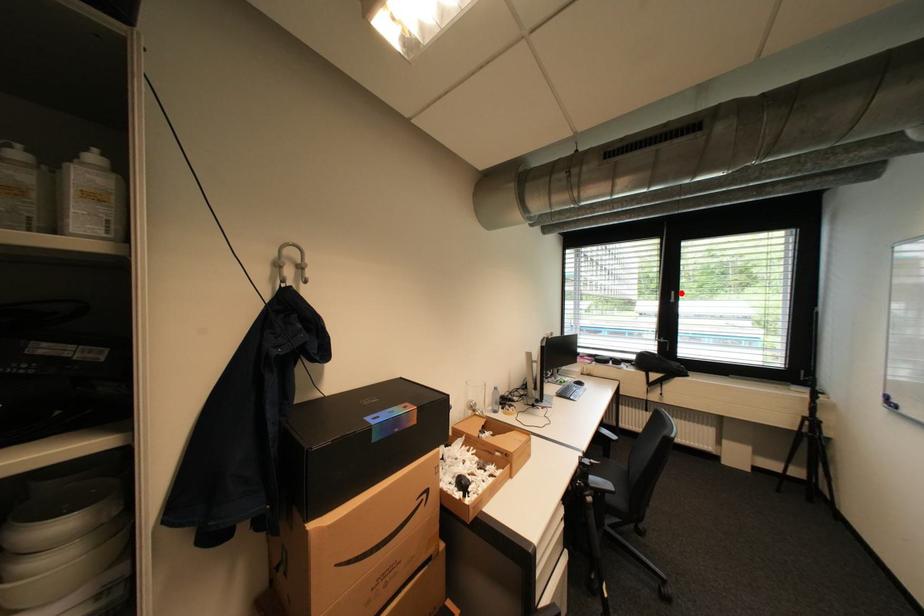
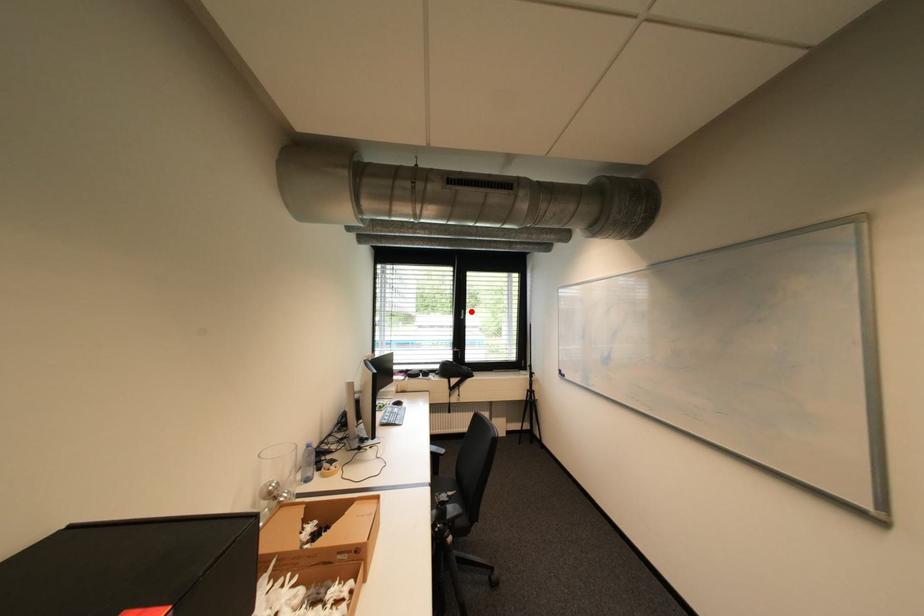
Based on the photo, I am providing you with two images of the same scene from different viewpoints. A red point is marked on the first image and another point is marked on the second image. Are the points marked in image1 and image2 representing the same 3D position?

Yes